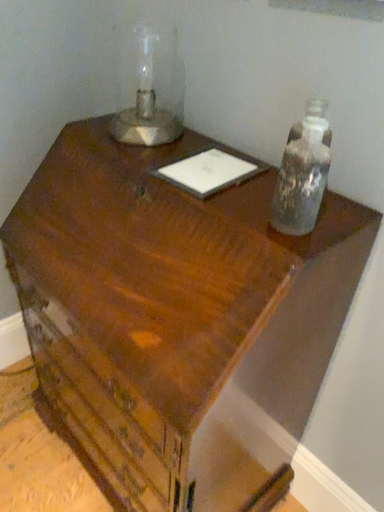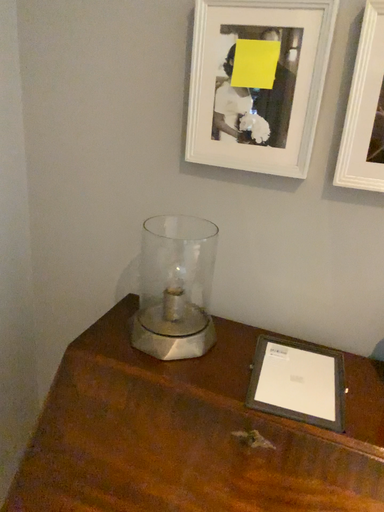
Question: How did the camera likely rotate when shooting the video?

Choices:
 (A) rotated left
 (B) rotated right

Answer: (B)